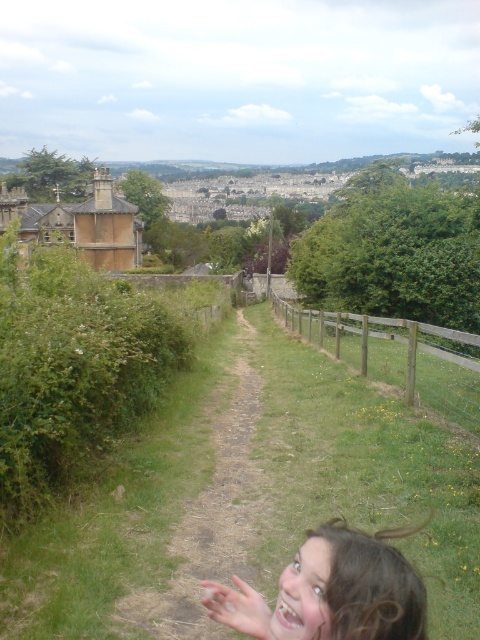
Does curly brown hair at lower center have a lesser width compared to wooden fence at right?

Indeed, curly brown hair at lower center has a lesser width compared to wooden fence at right.

Who is more distant from viewer, (322, 563) or (456, 365)?

The point (456, 365) is more distant.

Identify the location of curly brown hair at lower center. The image size is (480, 640). (333, 589).

I want to click on curly brown hair at lower center, so click(x=333, y=589).

Does curly brown hair at lower center appear under translucent skin hand at lower right?

Incorrect, curly brown hair at lower center is not positioned below translucent skin hand at lower right.

Is curly brown hair at lower center to the left of translucent skin hand at lower right from the viewer's perspective?

Incorrect, curly brown hair at lower center is not on the left side of translucent skin hand at lower right.

The height and width of the screenshot is (640, 480). I want to click on curly brown hair at lower center, so [x=333, y=589].

Can you confirm if green grassy path at center is positioned to the left of translucent skin hand at lower right?

Indeed, green grassy path at center is positioned on the left side of translucent skin hand at lower right.

Find the location of a particular element. The width and height of the screenshot is (480, 640). green grassy path at center is located at coordinates (211, 515).